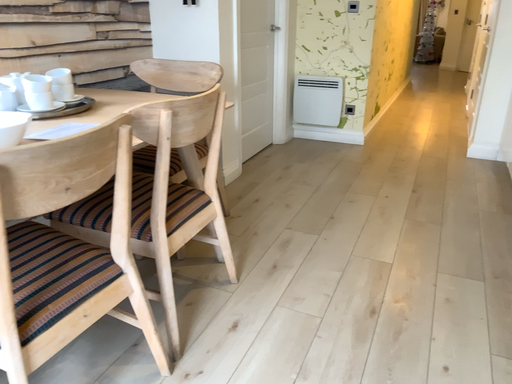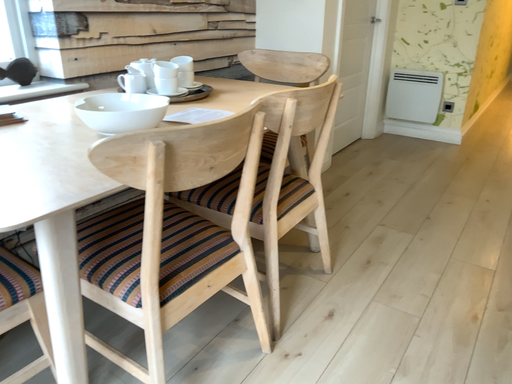
Question: How did the camera likely rotate when shooting the video?

Choices:
 (A) rotated right
 (B) rotated left

Answer: (B)